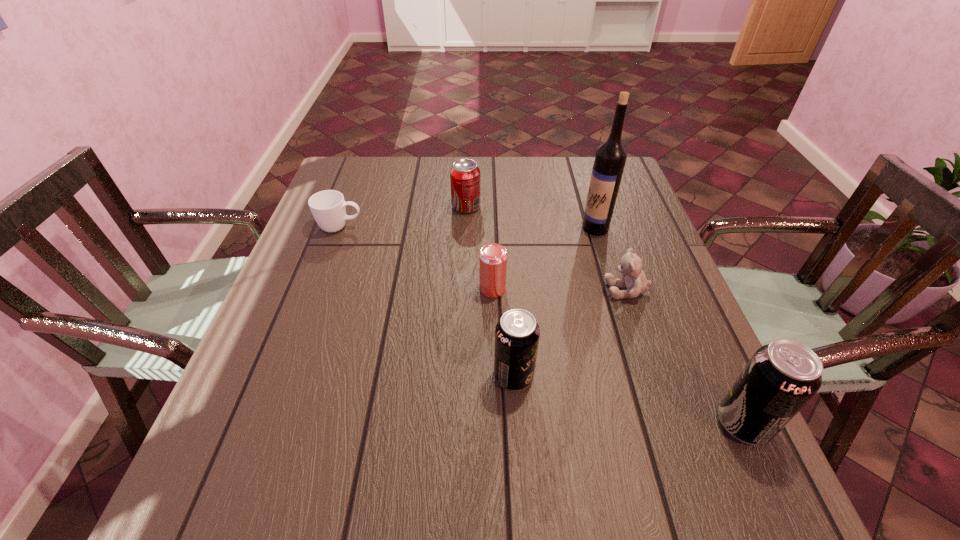
Identify the location of free space located 0.100m on the right of the second shortest soda can. The image size is (960, 540). (585, 376).

Where is `vacant position located on the back of the rightmost object`? vacant position located on the back of the rightmost object is located at coordinates (722, 377).

Identify the location of vacant space situated 0.330m on the left of the fourth tallest object. This screenshot has height=540, width=960. (336, 207).

In order to click on free region located with the handle on the side of the cup in this screenshot , I will do `click(437, 227)`.

At what (x,y) coordinates should I click in order to perform the action: click on vacant space located 0.110m on the label of the tallest object. Please return your answer as a coordinate pair (x, y). Looking at the image, I should click on (541, 228).

The width and height of the screenshot is (960, 540). Identify the location of free space located on the label of the tallest object. (452, 228).

At what (x,y) coordinates should I click in order to perform the action: click on vacant space located 0.260m on the label of the tallest object. Please return your answer as a coordinate pair (x, y). Looking at the image, I should click on pyautogui.click(x=486, y=228).

Identify the location of vacant area situated on the face of the teddy bear. (562, 289).

Identify the location of vacant space located 0.320m on the face of the teddy bear. This screenshot has height=540, width=960. (467, 289).

What are the coordinates of `vacant space located on the face of the teddy bear` in the screenshot? It's located at (549, 289).